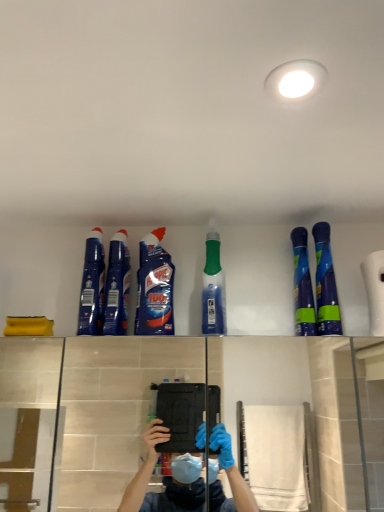
Question: From a real-world perspective, does blue glossy bottle at upper center, which is the 3th cleaning product from left to right, stand above blue glossy spray bottle at upper right, which is counted as the 6th cleaning product, starting from the left?

Choices:
 (A) no
 (B) yes

Answer: (B)

Question: Is blue glossy bottle at upper center, which ranks as the fourth cleaning product in right-to-left order, positioned with its back to blue glossy spray bottle at upper right, which is counted as the 6th cleaning product, starting from the left?

Choices:
 (A) yes
 (B) no

Answer: (B)

Question: Is blue glossy bottle at upper center, which ranks as the fourth cleaning product in right-to-left order, taller than blue glossy spray bottle at upper right, which is counted as the 6th cleaning product, starting from the left?

Choices:
 (A) yes
 (B) no

Answer: (B)

Question: Is blue glossy bottle at upper center, which is the 3th cleaning product from left to right, oriented towards blue glossy spray bottle at upper right, which is counted as the 6th cleaning product, starting from the left?

Choices:
 (A) no
 (B) yes

Answer: (A)

Question: Considering the relative positions of blue glossy bottle at upper center, which is the 3th cleaning product from left to right, and blue glossy spray bottle at upper right, positioned as the first cleaning product in right-to-left order, in the image provided, is blue glossy bottle at upper center, which is the 3th cleaning product from left to right, to the right of blue glossy spray bottle at upper right, positioned as the first cleaning product in right-to-left order, from the viewer's perspective?

Choices:
 (A) yes
 (B) no

Answer: (B)

Question: Would you say blue glossy bottle at upper center, which ranks as the fourth cleaning product in right-to-left order, is outside blue glossy spray bottle at upper right, which is counted as the 6th cleaning product, starting from the left?

Choices:
 (A) yes
 (B) no

Answer: (A)

Question: Is blue glossy spray bottles at upper right, the fifth cleaning product from the left, closer to the viewer compared to green translucent bottle at center, which is counted as the third cleaning product, starting from the right?

Choices:
 (A) no
 (B) yes

Answer: (A)

Question: Considering the relative sizes of blue glossy spray bottles at upper right, the fifth cleaning product from the left, and green translucent bottle at center, marked as the fourth cleaning product in a left-to-right arrangement, in the image provided, is blue glossy spray bottles at upper right, the fifth cleaning product from the left, smaller than green translucent bottle at center, marked as the fourth cleaning product in a left-to-right arrangement,?

Choices:
 (A) no
 (B) yes

Answer: (B)

Question: Is blue glossy spray bottles at upper right, the fifth cleaning product from the left, behind green translucent bottle at center, which is counted as the third cleaning product, starting from the right?

Choices:
 (A) yes
 (B) no

Answer: (A)

Question: Would you say blue glossy spray bottles at upper right, marked as the second cleaning product in a right-to-left arrangement, is a long distance from green translucent bottle at center, marked as the fourth cleaning product in a left-to-right arrangement?

Choices:
 (A) yes
 (B) no

Answer: (B)

Question: Does blue glossy spray bottles at upper right, marked as the second cleaning product in a right-to-left arrangement, have a lesser height compared to green translucent bottle at center, marked as the fourth cleaning product in a left-to-right arrangement?

Choices:
 (A) no
 (B) yes

Answer: (B)

Question: Can you confirm if blue glossy spray bottles at upper right, the fifth cleaning product from the left, is positioned to the left of green translucent bottle at center, marked as the fourth cleaning product in a left-to-right arrangement?

Choices:
 (A) no
 (B) yes

Answer: (A)

Question: Does blue glossy cleaner at upper left, placed as the 1th cleaning product when sorted from left to right, have a lesser height compared to green translucent bottle at center, marked as the fourth cleaning product in a left-to-right arrangement?

Choices:
 (A) no
 (B) yes

Answer: (B)